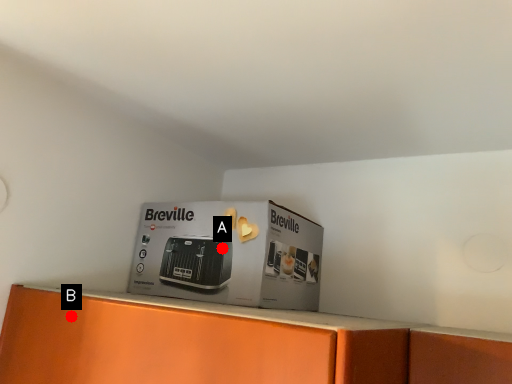
Question: Two points are circled on the image, labeled by A and B beside each circle. Which point appears farthest from the camera in this image?

Choices:
 (A) A is further
 (B) B is further

Answer: (A)